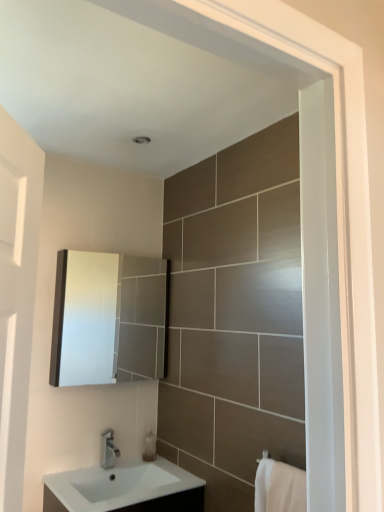
Question: Could you tell me if translucent plastic soap dispenser at lower center is turned towards silver metallic tap at lower center?

Choices:
 (A) no
 (B) yes

Answer: (A)

Question: Does translucent plastic soap dispenser at lower center appear on the right side of silver metallic tap at lower center?

Choices:
 (A) no
 (B) yes

Answer: (B)

Question: Can you confirm if translucent plastic soap dispenser at lower center is bigger than silver metallic tap at lower center?

Choices:
 (A) yes
 (B) no

Answer: (B)

Question: Does translucent plastic soap dispenser at lower center have a greater height compared to silver metallic tap at lower center?

Choices:
 (A) no
 (B) yes

Answer: (A)

Question: Considering the relative sizes of translucent plastic soap dispenser at lower center and silver metallic tap at lower center in the image provided, is translucent plastic soap dispenser at lower center thinner than silver metallic tap at lower center?

Choices:
 (A) yes
 (B) no

Answer: (A)

Question: Considering the positions of point pyautogui.click(x=145, y=434) and point pyautogui.click(x=92, y=359), is point pyautogui.click(x=145, y=434) closer or farther from the camera than point pyautogui.click(x=92, y=359)?

Choices:
 (A) closer
 (B) farther

Answer: (A)

Question: Relative to matte white cabinet at upper left, is translucent plastic soap dispenser at lower center in front or behind?

Choices:
 (A) front
 (B) behind

Answer: (B)

Question: Is translucent plastic soap dispenser at lower center taller or shorter than matte white cabinet at upper left?

Choices:
 (A) short
 (B) tall

Answer: (A)

Question: In the image, is translucent plastic soap dispenser at lower center on the left side or the right side of matte white cabinet at upper left?

Choices:
 (A) right
 (B) left

Answer: (A)

Question: From a real-world perspective, is white glossy sink at lower center, the 1th sink from the bottom, physically located above or below white glossy sink at lower center, which appears as the 2th sink when ordered from the bottom?

Choices:
 (A) below
 (B) above

Answer: (A)

Question: Is white glossy sink at lower center, the 1th sink from the bottom, situated inside white glossy sink at lower center, arranged as the first sink when viewed from the top, or outside?

Choices:
 (A) outside
 (B) inside

Answer: (A)

Question: From the image's perspective, is white glossy sink at lower center, marked as the second sink in a top-to-bottom arrangement, located above or below white glossy sink at lower center, which appears as the 2th sink when ordered from the bottom?

Choices:
 (A) below
 (B) above

Answer: (A)

Question: Is white glossy sink at lower center, the 1th sink from the bottom, taller or shorter than white glossy sink at lower center, arranged as the first sink when viewed from the top?

Choices:
 (A) tall
 (B) short

Answer: (A)

Question: Relative to white glossy sink at lower center, which appears as the 2th sink when ordered from the bottom, is translucent plastic soap dispenser at lower center in front or behind?

Choices:
 (A) behind
 (B) front

Answer: (A)

Question: From the image's perspective, is translucent plastic soap dispenser at lower center located above or below white glossy sink at lower center, arranged as the first sink when viewed from the top?

Choices:
 (A) below
 (B) above

Answer: (B)